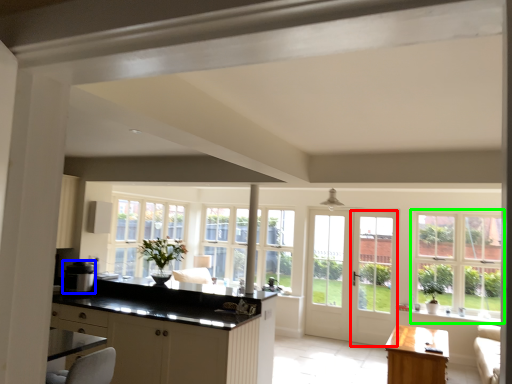
Question: Which object is the closest to the screen door (highlighted by a red box)? Choose among these: appliance (highlighted by a blue box) or window (highlighted by a green box).

Choices:
 (A) appliance
 (B) window

Answer: (B)